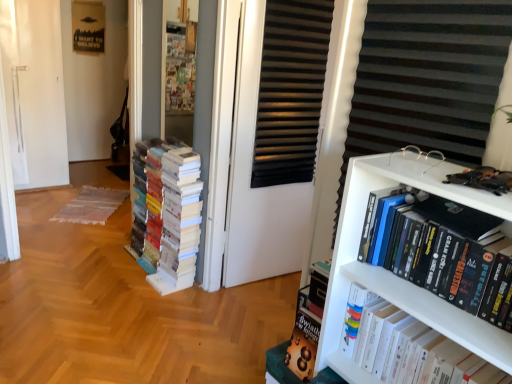
At what (x,y) coordinates should I click in order to perform the action: click on free space in front of white paper books at left, placed as the third book when sorted from right to left. Please return your answer as a coordinate pair (x, y). Looking at the image, I should click on (128, 307).